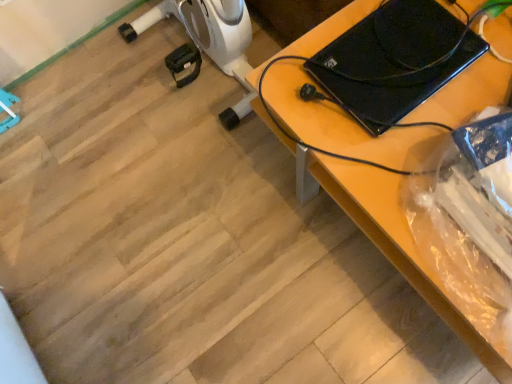
This screenshot has width=512, height=384. I want to click on vacant area on top of black glossy laptop at upper right (from a real-world perspective), so click(388, 67).